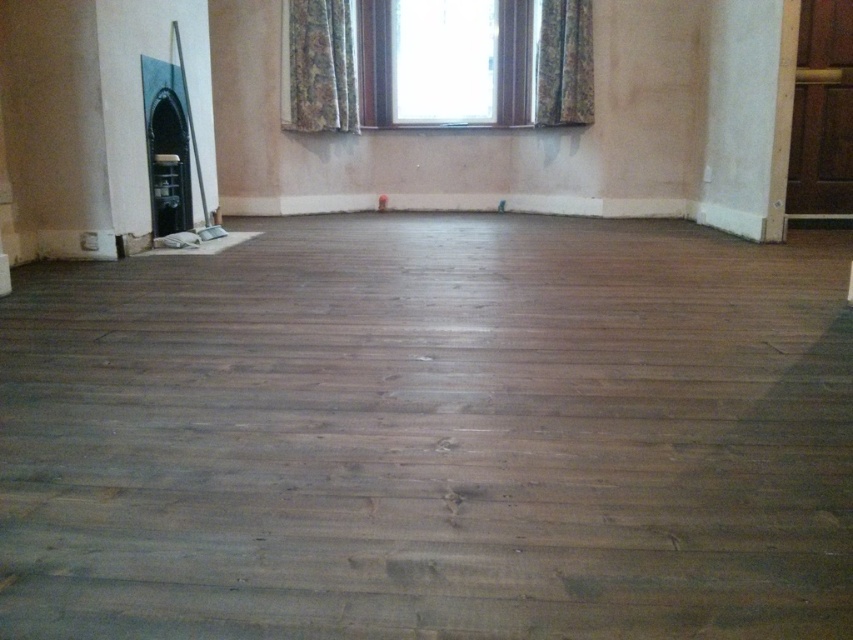
Question: Is clear glass window at upper center closer to camera compared to textured floral fabric at upper center?

Choices:
 (A) no
 (B) yes

Answer: (A)

Question: Which of the following is the farthest from the observer?

Choices:
 (A) dark brown wood floor at center
 (B) clear glass window at upper center
 (C) floral fabric curtain at upper center
 (D) textured floral fabric at upper center

Answer: (B)

Question: Is dark brown wood floor at center further to the viewer compared to floral fabric curtain at upper center?

Choices:
 (A) no
 (B) yes

Answer: (A)

Question: Can you confirm if dark brown wood floor at center is positioned to the left of textured floral fabric at upper center?

Choices:
 (A) yes
 (B) no

Answer: (A)

Question: Which point is farther to the camera?

Choices:
 (A) clear glass window at upper center
 (B) floral fabric curtain at upper center
 (C) textured floral fabric at upper center
 (D) dark brown wood floor at center

Answer: (A)

Question: Which point appears closest to the camera in this image?

Choices:
 (A) (352, 106)
 (B) (519, 106)
 (C) (537, 268)
 (D) (581, 90)

Answer: (C)